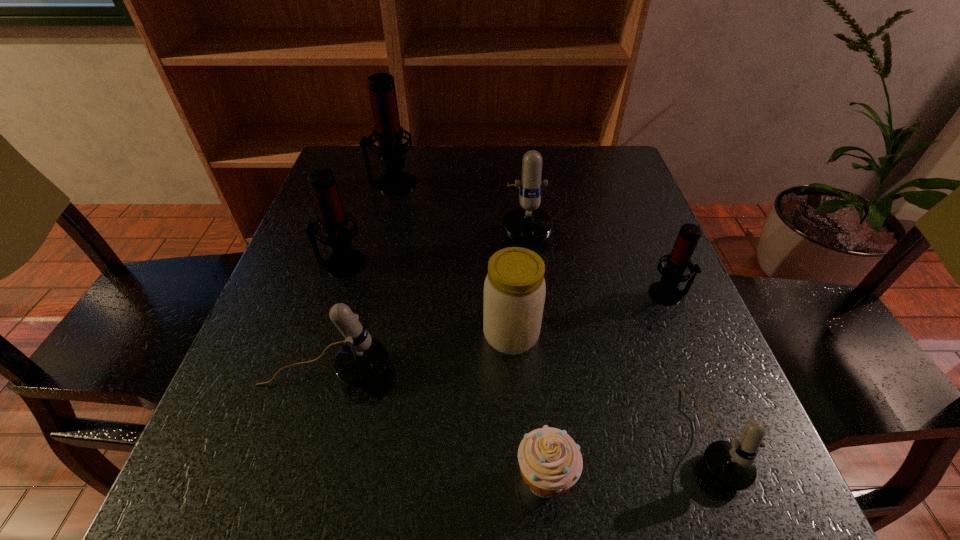
Image resolution: width=960 pixels, height=540 pixels. What are the coordinates of `the tallest microphone` in the screenshot? It's located at (388, 132).

Where is `the biggest red microphone`? The height and width of the screenshot is (540, 960). the biggest red microphone is located at coordinates (388, 132).

You are a GUI agent. You are given a task and a screenshot of the screen. Output one action in this format:
    pyautogui.click(x=<x>, y=<y>)
    Task: Click on the second farthest red microphone
    
    Given the screenshot: What is the action you would take?
    pyautogui.click(x=344, y=261)

At what (x,y) coordinates should I click in order to perform the action: click on the biggest white microphone. Please return your answer as a coordinate pair (x, y). This screenshot has width=960, height=540. Looking at the image, I should click on (527, 224).

The width and height of the screenshot is (960, 540). In order to click on the second white microphone from left to right in this screenshot , I will do 527,224.

Where is `jar`? Image resolution: width=960 pixels, height=540 pixels. jar is located at coordinates (514, 289).

Locate an element on the screen. the second biggest white microphone is located at coordinates (362, 361).

This screenshot has width=960, height=540. In order to click on the rightmost red microphone in this screenshot , I will do `click(665, 291)`.

The height and width of the screenshot is (540, 960). In order to click on the smallest red microphone in this screenshot , I will do `click(665, 291)`.

Locate an element on the screen. This screenshot has height=540, width=960. the smallest white microphone is located at coordinates (731, 464).